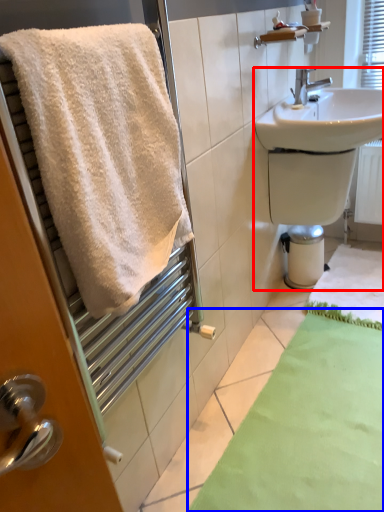
Question: Which object appears closest to the camera in this image, sink (highlighted by a red box) or bath mat (highlighted by a blue box)?

Choices:
 (A) sink
 (B) bath mat

Answer: (B)